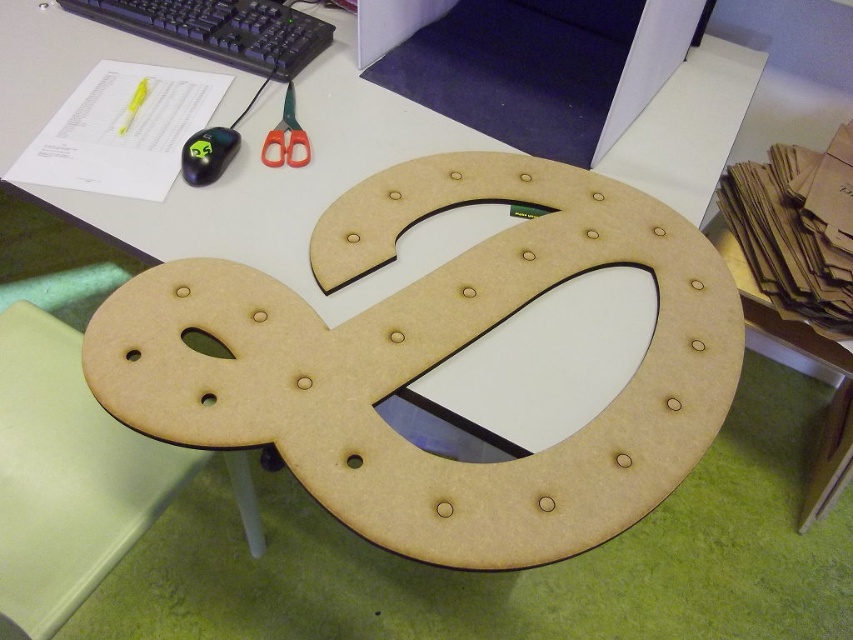
You are organizing your desk and need to place a 20 cm long ruler between the black plastic keyboard at upper left and the green plastic scissors at upper center. Will there be enough space for the ruler to fit horizontally between them?

The distance between the black plastic keyboard at upper left and the green plastic scissors at upper center is 18.30 centimeters. Since the ruler is 20 cm long, it will not fit horizontally between them as the space is shorter than the ruler.

You are organizing your desk and want to place a new item between the wooden horseshoe at center and the black plastic keyboard at upper left. What is the minimum width of the item to fit perfectly between them?

The distance between the wooden horseshoe at center and the black plastic keyboard at upper left is 20.07 inches, so the item must be at least 20.07 inches wide to fit perfectly between them.

You are organizing items on a desk and need to place a new item between the wooden horseshoe at center and the black plastic keyboard at upper left. Is there enough vertical space between them to fit an item that is 5 cm tall?

The wooden horseshoe at center is located below the black plastic keyboard at upper left, but the exact vertical distance between them isn